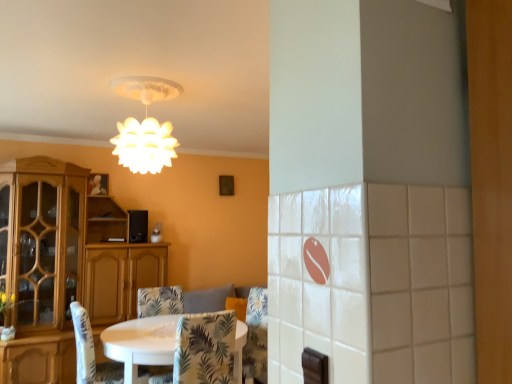
This screenshot has height=384, width=512. What do you see at coordinates (159, 301) in the screenshot? I see `floral fabric chair at center, which is counted as the 1th chair, starting from the back` at bounding box center [159, 301].

Identify the location of white fabric chair at lower left, the second chair viewed from the front. (91, 353).

Locate an element on the screen. Image resolution: width=512 pixels, height=384 pixels. wooden cabinet at left is located at coordinates (41, 265).

From the image's perspective, which object appears higher, floral fabric chair at center, the 3th chair when ordered from front to back, or white matte lampshade at upper center?

white matte lampshade at upper center appears higher in the image.

Between point (172, 289) and point (146, 79), which one is positioned behind?

Point (172, 289)

Considering the sizes of floral fabric chair at center, the 3th chair when ordered from front to back, and white matte lampshade at upper center in the image, is floral fabric chair at center, the 3th chair when ordered from front to back, wider or thinner than white matte lampshade at upper center?

Considering their sizes, floral fabric chair at center, the 3th chair when ordered from front to back, looks broader than white matte lampshade at upper center.

Locate an element on the screen. The height and width of the screenshot is (384, 512). lamp lying in front of the floral fabric chair at center, which is counted as the 1th chair, starting from the back is located at coordinates (145, 126).

Consider the image. Is floral fabric chair at center, the 3th chair when ordered from front to back, in contact with wooden cabinet at left?

No, floral fabric chair at center, the 3th chair when ordered from front to back, is not beside wooden cabinet at left.

Between floral fabric chair at center, the 3th chair when ordered from front to back, and wooden cabinet at left, which one has smaller width?

With smaller width is floral fabric chair at center, the 3th chair when ordered from front to back.

The width and height of the screenshot is (512, 384). Find the location of `cabinetry behind the floral fabric chair at center, which is counted as the 1th chair, starting from the back`. cabinetry behind the floral fabric chair at center, which is counted as the 1th chair, starting from the back is located at coordinates (41, 265).

Is floral fabric chair at center, the 3th chair when ordered from front to back, aimed at wooden cabinet at left?

No, floral fabric chair at center, the 3th chair when ordered from front to back, is not aimed at wooden cabinet at left.

Considering the sizes of objects floral fabric chair at center, the 3th chair when ordered from front to back, and patterned fabric chair at center, the third chair when ordered from back to front, in the image provided, who is bigger, floral fabric chair at center, the 3th chair when ordered from front to back, or patterned fabric chair at center, the third chair when ordered from back to front,?

Bigger between the two is floral fabric chair at center, the 3th chair when ordered from front to back.

Is patterned fabric chair at center, which appears as the first chair when viewed from the front, located within floral fabric chair at center, the 3th chair when ordered from front to back?

That's incorrect, patterned fabric chair at center, which appears as the first chair when viewed from the front, is not inside floral fabric chair at center, the 3th chair when ordered from front to back.

Which object is further away from the camera taking this photo, floral fabric chair at center, the 3th chair when ordered from front to back, or patterned fabric chair at center, the third chair when ordered from back to front?

floral fabric chair at center, the 3th chair when ordered from front to back, is further from the camera.

From the image's perspective, count 2nd chairs upward from the floral fabric chair at center, which is counted as the 1th chair, starting from the back, and point to it. Please provide its 2D coordinates.

[(204, 350)]

Is patterned fabric chair at center, which appears as the first chair when viewed from the front, completely or partially inside white fabric chair at lower left, arranged as the 2th chair when viewed from the back?

Definitely not — patterned fabric chair at center, which appears as the first chair when viewed from the front, is not inside white fabric chair at lower left, arranged as the 2th chair when viewed from the back.

This screenshot has width=512, height=384. In order to click on chair lying above the white fabric chair at lower left, the second chair viewed from the front (from the image's perspective) in this screenshot , I will do click(x=204, y=350).

Is white fabric chair at lower left, the second chair viewed from the front, oriented away from patterned fabric chair at center, which appears as the first chair when viewed from the front?

No, white fabric chair at lower left, the second chair viewed from the front, is not facing the opposite direction of patterned fabric chair at center, which appears as the first chair when viewed from the front.

From the picture: Between wooden cabinet at left and patterned fabric chair at center, the third chair when ordered from back to front, which one has larger width?

With larger width is wooden cabinet at left.

Are wooden cabinet at left and patterned fabric chair at center, the third chair when ordered from back to front, making contact?

No, wooden cabinet at left is not touching patterned fabric chair at center, the third chair when ordered from back to front.

Could you tell me if wooden cabinet at left is facing patterned fabric chair at center, which appears as the first chair when viewed from the front?

Yes, wooden cabinet at left is oriented towards patterned fabric chair at center, which appears as the first chair when viewed from the front.

Does wooden cabinet at left have a larger size compared to patterned fabric chair at center, which appears as the first chair when viewed from the front?

Indeed, wooden cabinet at left has a larger size compared to patterned fabric chair at center, which appears as the first chair when viewed from the front.

Is white matte lampshade at upper center with wooden cabinet at left?

white matte lampshade at upper center and wooden cabinet at left are not in contact.

Based on their positions, is white matte lampshade at upper center located to the left or right of wooden cabinet at left?

Based on their positions, white matte lampshade at upper center is located to the right of wooden cabinet at left.

Does white matte lampshade at upper center have a larger size compared to wooden cabinet at left?

Actually, white matte lampshade at upper center might be smaller than wooden cabinet at left.

From the image's perspective, is white matte lampshade at upper center located above wooden cabinet at left?

Yes.

What's the angular difference between patterned fabric chair at center, the third chair when ordered from back to front, and white fabric chair at lower left, the second chair viewed from the front,'s facing directions?

They differ by 89 degrees in their facing directions.

From the image's perspective, relative to white fabric chair at lower left, the second chair viewed from the front, is patterned fabric chair at center, the third chair when ordered from back to front, above or below?

patterned fabric chair at center, the third chair when ordered from back to front, is above white fabric chair at lower left, the second chair viewed from the front.

Does patterned fabric chair at center, which appears as the first chair when viewed from the front, have a smaller size compared to white fabric chair at lower left, the second chair viewed from the front?

Yes.

Measure the distance between patterned fabric chair at center, the third chair when ordered from back to front, and white fabric chair at lower left, arranged as the 2th chair when viewed from the back.

They are 28.34 inches apart.

Locate an element on the screen. This screenshot has height=384, width=512. the 3rd chair below the white matte lampshade at upper center (from the image's perspective) is located at coordinates (159, 301).

Locate an element on the screen. The height and width of the screenshot is (384, 512). cabinetry lying on the left of floral fabric chair at center, the 3th chair when ordered from front to back is located at coordinates (41, 265).

From the image, which object appears to be nearer to white fabric chair at lower left, arranged as the 2th chair when viewed from the back, floral fabric chair at center, the 3th chair when ordered from front to back, or white matte lampshade at upper center?

The object closer to white fabric chair at lower left, arranged as the 2th chair when viewed from the back, is floral fabric chair at center, the 3th chair when ordered from front to back.

Looking at this image, from the image, which object appears to be farther from patterned fabric chair at center, the third chair when ordered from back to front, white matte lampshade at upper center or floral fabric chair at center, the 3th chair when ordered from front to back?

white matte lampshade at upper center is further to patterned fabric chair at center, the third chair when ordered from back to front.

From the image, which object appears to be nearer to white matte lampshade at upper center, wooden cabinet at left or patterned fabric chair at center, which appears as the first chair when viewed from the front?

patterned fabric chair at center, which appears as the first chair when viewed from the front, is closer to white matte lampshade at upper center.

Based on their spatial positions, is white matte lampshade at upper center or patterned fabric chair at center, which appears as the first chair when viewed from the front, further from wooden cabinet at left?

patterned fabric chair at center, which appears as the first chair when viewed from the front, is positioned further to the anchor wooden cabinet at left.

From the image, which object appears to be farther from white fabric chair at lower left, arranged as the 2th chair when viewed from the back, white matte lampshade at upper center or wooden cabinet at left?

wooden cabinet at left lies further to white fabric chair at lower left, arranged as the 2th chair when viewed from the back, than the other object.

Which object lies nearer to the anchor point white fabric chair at lower left, the second chair viewed from the front, patterned fabric chair at center, the third chair when ordered from back to front, or white matte lampshade at upper center?

patterned fabric chair at center, the third chair when ordered from back to front, is positioned closer to the anchor white fabric chair at lower left, the second chair viewed from the front.

Looking at the image, which one is located further to white matte lampshade at upper center, white fabric chair at lower left, the second chair viewed from the front, or wooden cabinet at left?

The object further to white matte lampshade at upper center is wooden cabinet at left.

Estimate the real-world distances between objects in this image. Which object is closer to floral fabric chair at center, the 3th chair when ordered from front to back, wooden cabinet at left or white fabric chair at lower left, the second chair viewed from the front?

white fabric chair at lower left, the second chair viewed from the front.

Image resolution: width=512 pixels, height=384 pixels. What are the coordinates of `chair between wooden cabinet at left and floral fabric chair at center, the 3th chair when ordered from front to back` in the screenshot? It's located at (91, 353).

Identify the location of cabinetry between white matte lampshade at upper center and patterned fabric chair at center, which appears as the first chair when viewed from the front, from top to bottom. The width and height of the screenshot is (512, 384). (41, 265).

Where is `chair between patterned fabric chair at center, which appears as the first chair when viewed from the front, and floral fabric chair at center, which is counted as the 1th chair, starting from the back, from front to back`? chair between patterned fabric chair at center, which appears as the first chair when viewed from the front, and floral fabric chair at center, which is counted as the 1th chair, starting from the back, from front to back is located at coordinates (91, 353).

I want to click on cabinetry that lies between white matte lampshade at upper center and white fabric chair at lower left, the second chair viewed from the front, from top to bottom, so click(41, 265).